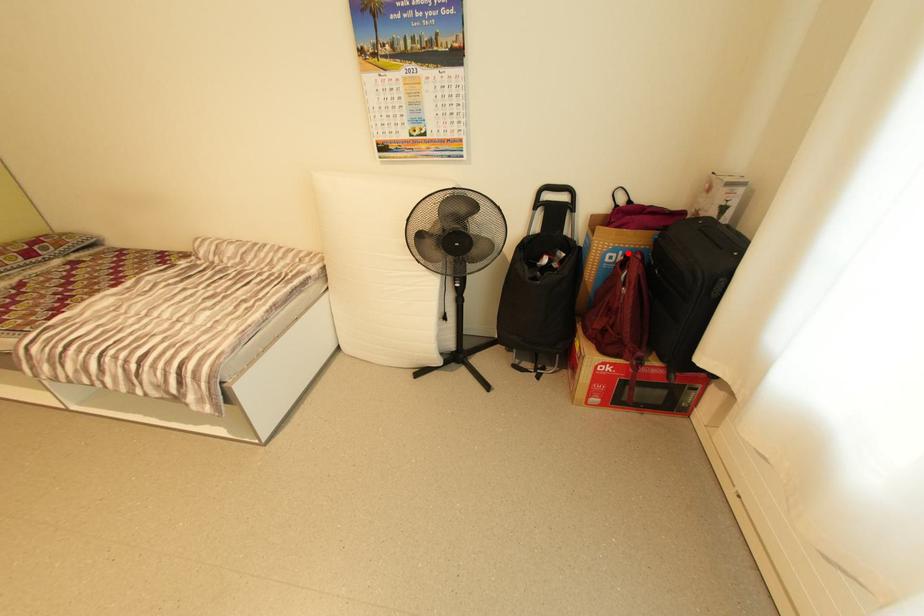
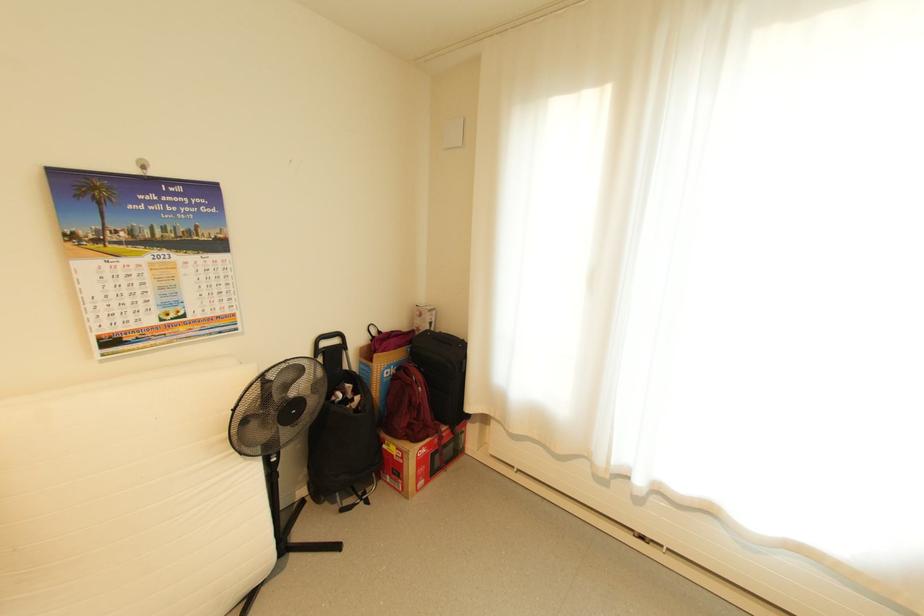
Question: I am providing you with two images of the same scene from different viewpoints. Image1 has a red point marked. In image2, the corresponding 3D location appears at what relative position? Reply with the corresponding letter.

Choices:
 (A) Closer
 (B) Farther

Answer: (B)